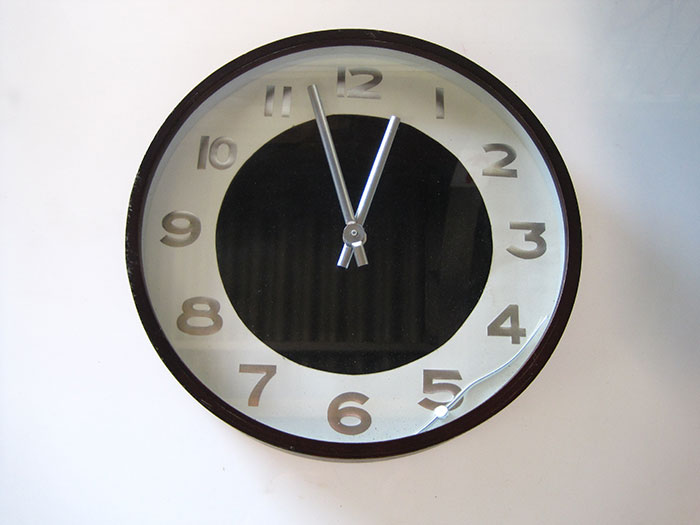
Identify the location of room reflections off glass on clock. (323, 345), (458, 180), (311, 69).